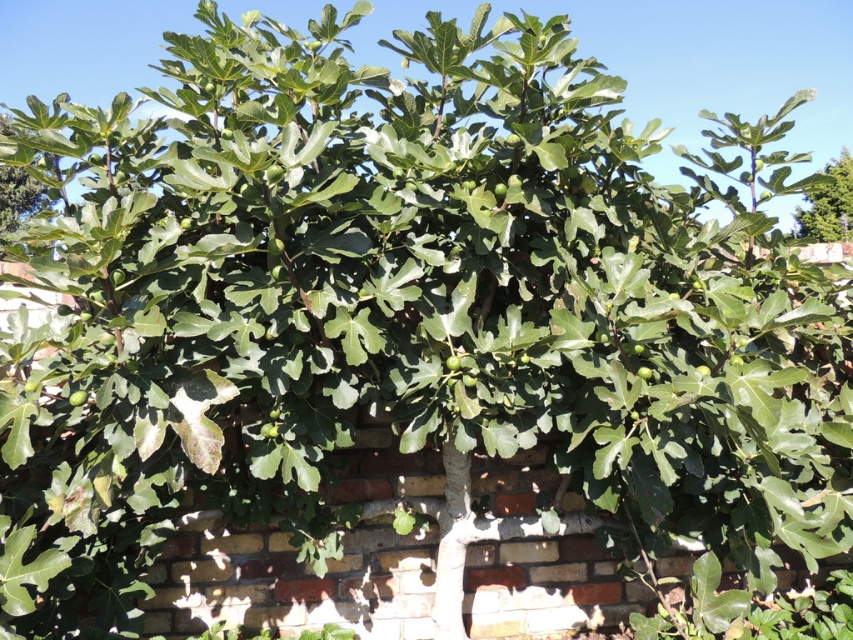
You are standing in a garden and see the green leafy fig tree at upper right and the green matte fig tree at upper left. Which one is positioned more to the right side of the garden?

The green leafy fig tree at upper right is positioned more to the right side of the garden compared to the green matte fig tree at upper left.

You are a gardener standing at the center of the scene. You need to reach the green leafy fig tree at upper right to prune some branches. Given your current position, in which direction should you move to approach the tree?

The green leafy fig tree at upper right is located at point (828, 205), which means you should move towards the upper right direction to reach it.